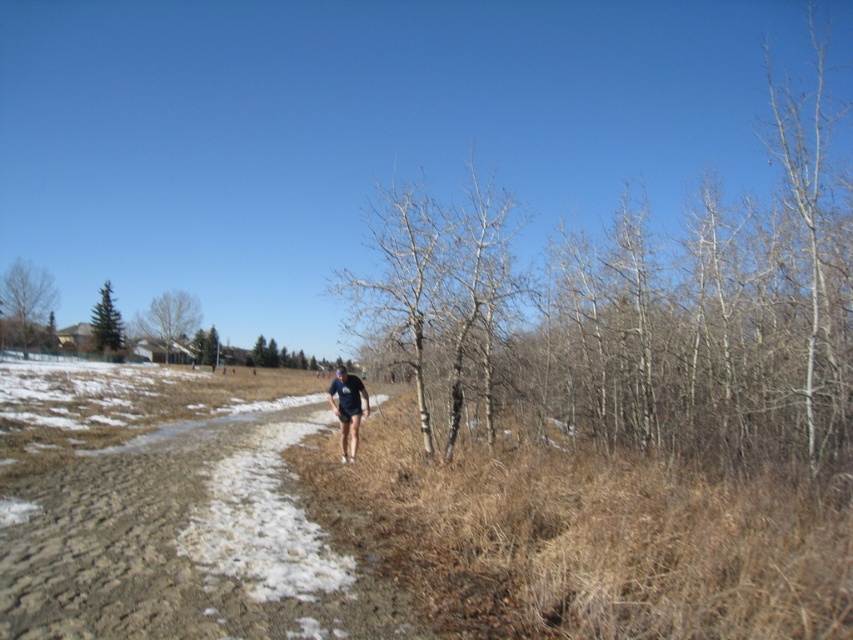
Based on the photo, you are a hiker planning to cross the brown dirt track at center and the dark blue fabric at center. Which path is wider?

The brown dirt track at center is wider than the dark blue fabric at center.

You are a hiker planning to take a photo of the smooth bark tree at center and the dark blue fabric at center. Which object should you focus on first if you want both to be in sharp focus?

You should focus on the smooth bark tree at center first because it is larger in size than the dark blue fabric at center, so it will require more precise focusing to ensure sharpness.

You are navigating a hiking trail in the countryside. You see a point marked at coordinates (186,541). What does this point represent?

The point at coordinates (186,541) corresponds to the brown dirt track at center.